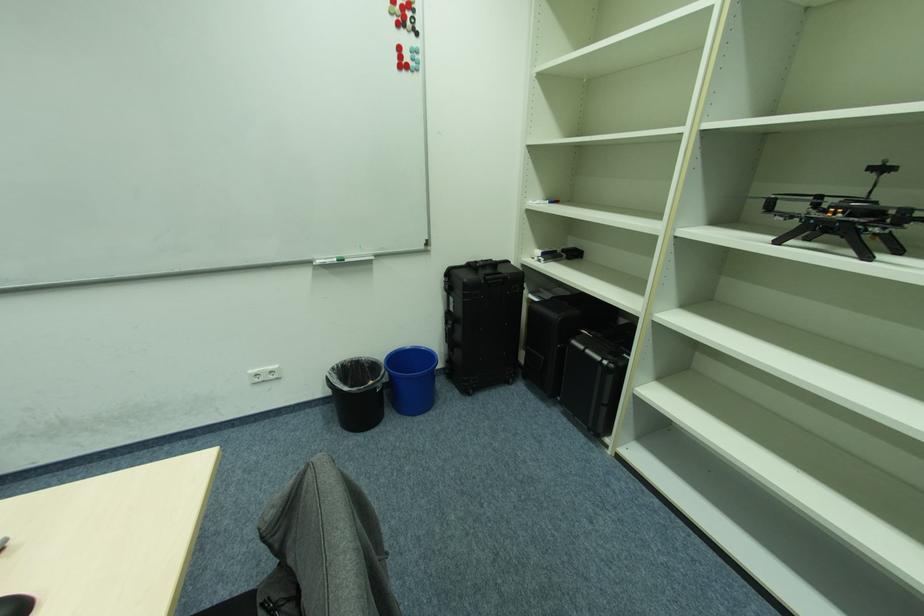
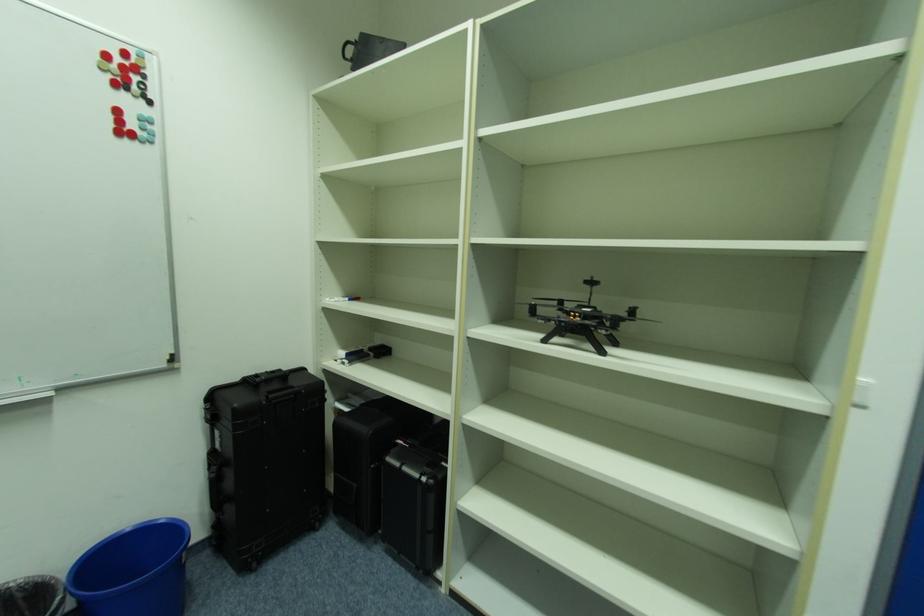
Question: The camera is either moving clockwise (left) or counter-clockwise (right) around the object. The first image is from the beginning of the video and the second image is from the end. Is the camera moving left or right when shooting the video?

Choices:
 (A) Left
 (B) Right

Answer: (A)